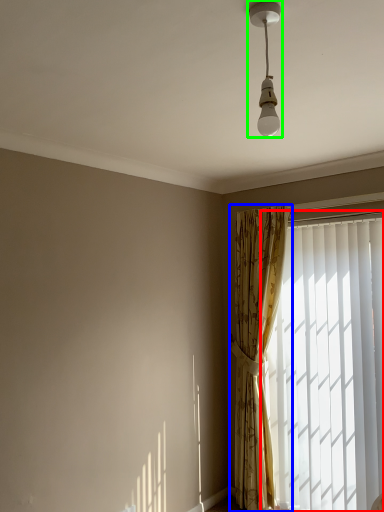
Question: Which is farther away from window (highlighted by a red box)? curtain (highlighted by a blue box) or lamp (highlighted by a green box)?

Choices:
 (A) curtain
 (B) lamp

Answer: (B)